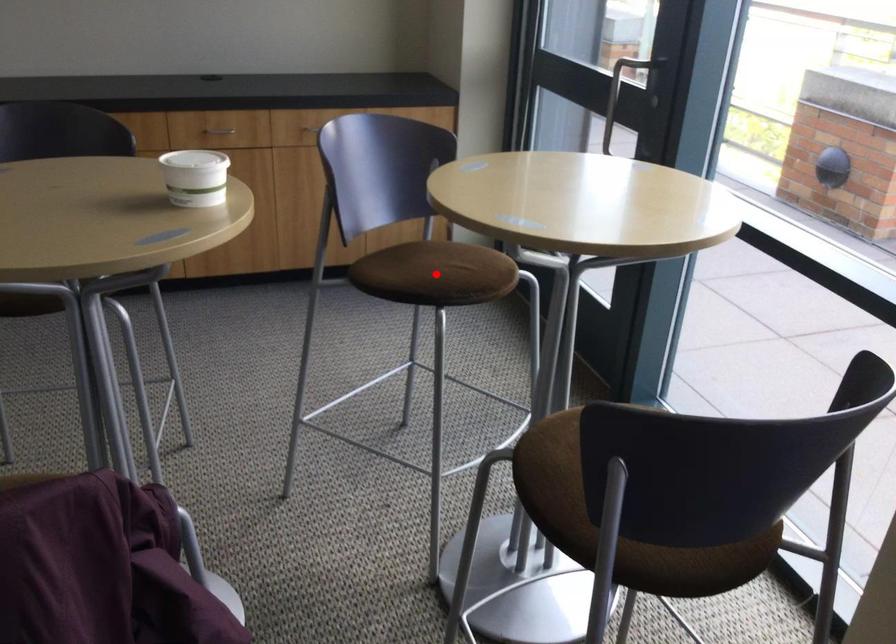
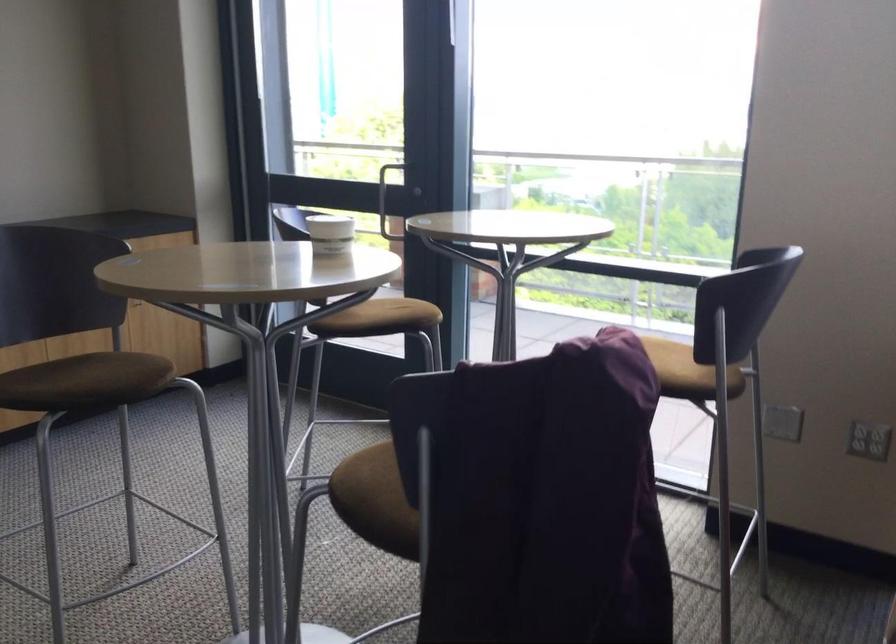
Locate, in the second image, the point that corresponds to the highlighted location in the first image.

(401, 314)